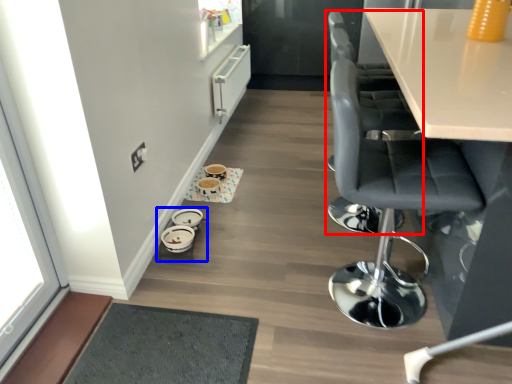
Question: Which point is further to the camera, chair (highlighted by a red box) or round table (highlighted by a blue box)?

Choices:
 (A) chair
 (B) round table

Answer: (B)